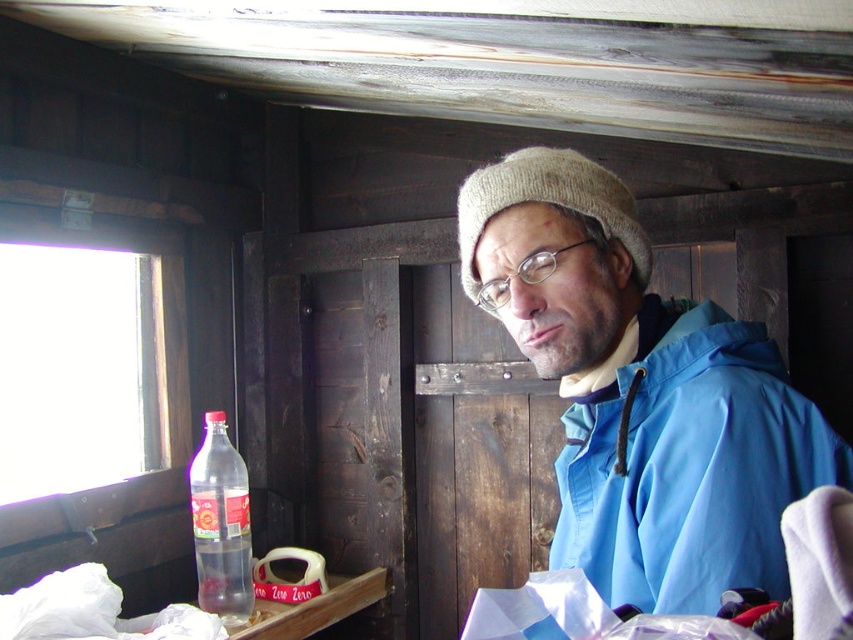
You are organizing a clothing donation drive and need to determine which item takes up more space horizontally between the blue fabric jacket at center and the knitted beige hat at upper center. Which item should you consider first for space optimization?

The blue fabric jacket at center has a greater width than the knitted beige hat at upper center, so you should prioritize the blue fabric jacket at center for space optimization.

You are standing inside a rustic wooden cabin and want to move from point A to point B. Point A is located at coordinate point (718, 502) and point B is at coordinate point (201, 579). Which point is closer to you if you are facing the window?

Point A at coordinate point (718, 502) is closer to you than point B at coordinate point (201, 579) because the description states that point (718, 502) is closer to the viewer.